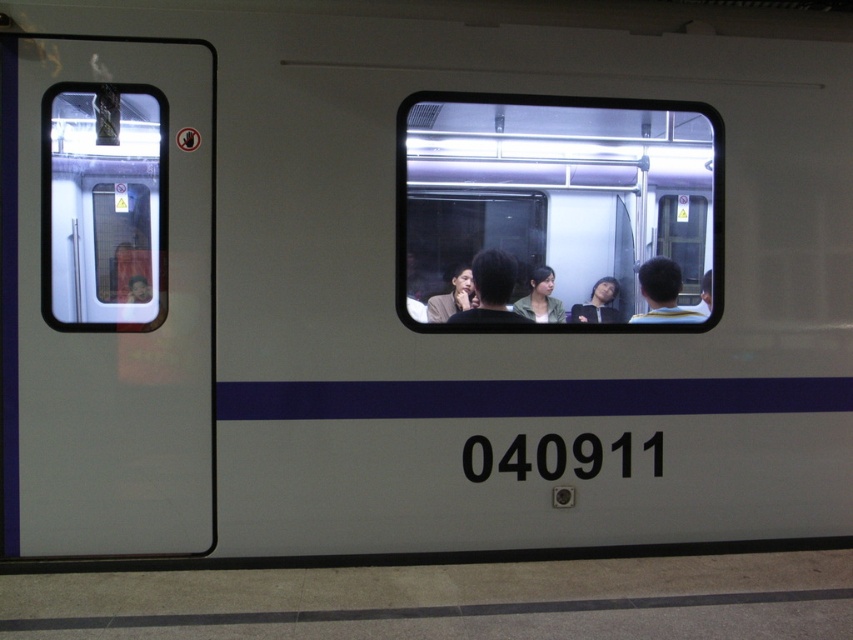
You are waiting at the train station and see the transparent glass train window at center and the matte black shirt at center. Which object is higher from the ground?

The transparent glass train window at center is located above the matte black shirt at center, so it is higher from the ground.

You are a passenger on the train and want to look outside through the transparent glass train window at center. However, there is a person wearing a yellow striped shirt at center blocking your view. Can you stand up and look over them?

The transparent glass train window at center is taller than the yellow striped shirt at center, so yes, you can stand up and look over the yellow striped shirt at center to see outside.

You are standing on the platform and want to check the train number displayed on the side of the train. You have a smartphone with a camera. The train number is located at the lower part of the train. To take a clear photo of the train number, should you position yourself closer to the transparent glass train window at left or farther away from it?

You should position yourself closer to the transparent glass train window at left to take a clear photo of the train number, which is located at the lower part of the train. Being closer allows for better focus and clarity on the specific area where the train number is displayed.